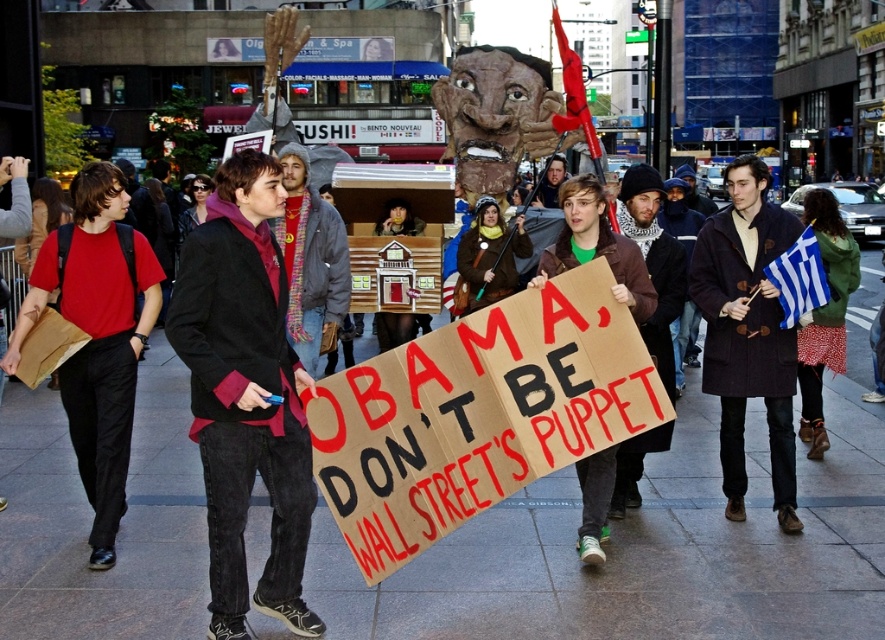
Question: Can you confirm if dark red fabric jacket at center is wider than cardboard sign at center?

Choices:
 (A) yes
 (B) no

Answer: (A)

Question: Which point appears farthest from the camera in this image?

Choices:
 (A) (339, 272)
 (B) (603, 532)
 (C) (214, 209)

Answer: (A)

Question: Which of the following is the closest to the observer?

Choices:
 (A) red sweater at center
 (B) brown wool coat at center
 (C) dark brown wool coat at center
 (D) brown stone pavement at center

Answer: (D)

Question: Which of the following is the farthest from the observer?

Choices:
 (A) dark brown leather jacket at center
 (B) dark brown wool coat at center
 (C) red sweater at center

Answer: (A)

Question: Considering the relative positions of dark red fabric jacket at center and brown wool coat at center in the image provided, where is dark red fabric jacket at center located with respect to brown wool coat at center?

Choices:
 (A) right
 (B) left

Answer: (B)

Question: Does red sweater at center have a smaller size compared to brown wool coat at center?

Choices:
 (A) no
 (B) yes

Answer: (B)